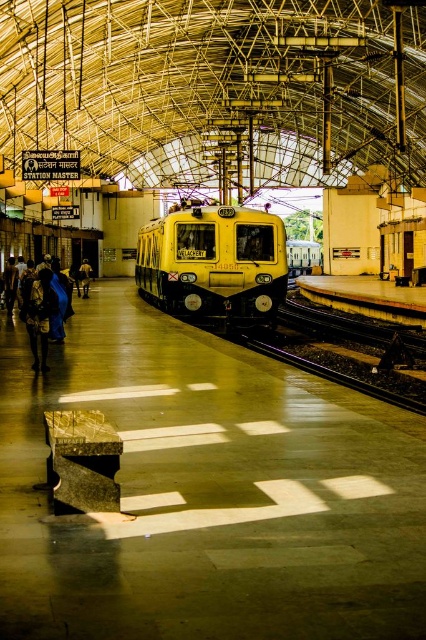
Question: Can you confirm if yellow matte train at center is bigger than dark blue fabric at left?

Choices:
 (A) yes
 (B) no

Answer: (A)

Question: Does yellow matte train at center appear on the left side of dark blue fabric at left?

Choices:
 (A) no
 (B) yes

Answer: (A)

Question: Does yellow matte train at center have a lesser width compared to dark blue fabric at left?

Choices:
 (A) no
 (B) yes

Answer: (A)

Question: Which of the following is the farthest from the observer?

Choices:
 (A) dark blue fabric at left
 (B) black metal train track at lower center

Answer: (A)

Question: Among these objects, which one is farthest from the camera?

Choices:
 (A) yellow matte train at center
 (B) black metal train track at lower center

Answer: (A)

Question: Among these points, which one is nearest to the camera?

Choices:
 (A) (83, 291)
 (B) (206, 296)
 (C) (394, 394)

Answer: (C)